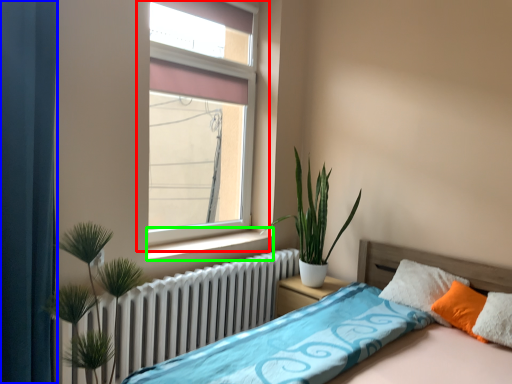
Question: Estimate the real-world distances between objects in this image. Which object is farther from window (highlighted by a red box), curtain (highlighted by a blue box) or window sill (highlighted by a green box)?

Choices:
 (A) curtain
 (B) window sill

Answer: (A)